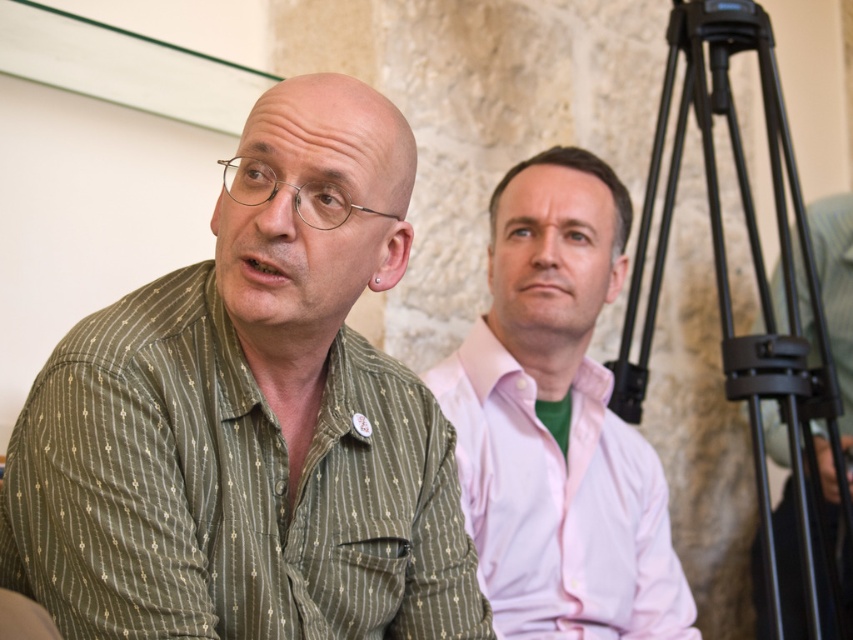
Consider the image. You are attending a formal event and notice the green striped shirt at left and the black metal tripod at right in the scene. Based on their positions, which object is closer to the floor?

The green striped shirt at left is located below the black metal tripod at right, meaning it is closer to the floor than the tripod.

You are a photographer setting up for a group photo. You need to position two subjects wearing the green striped shirt at left and the pink smooth shirt at center so that their shirts are visible in the frame. Based on their current positions, which shirt is higher up in the image?

The green striped shirt at left is above the pink smooth shirt at center, so it is higher up in the image.